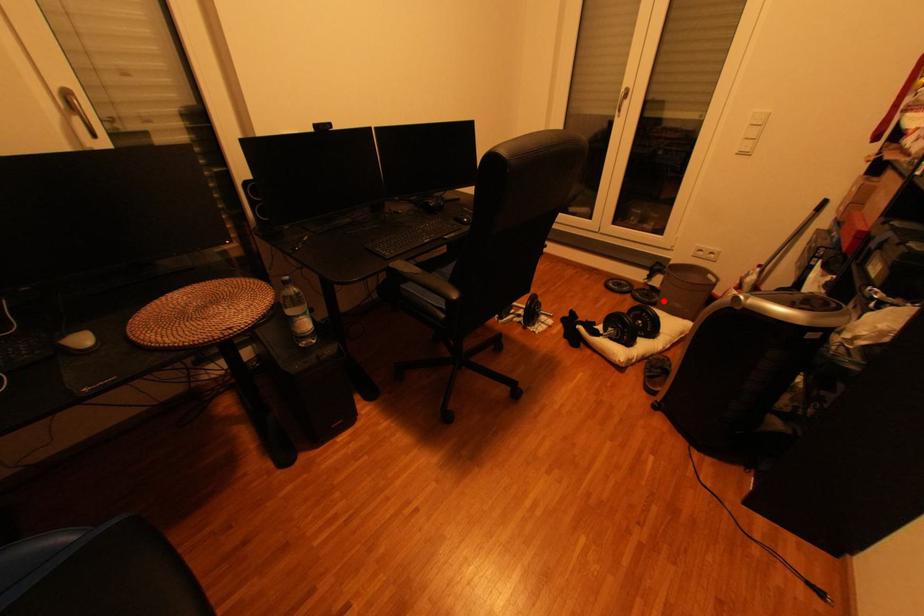
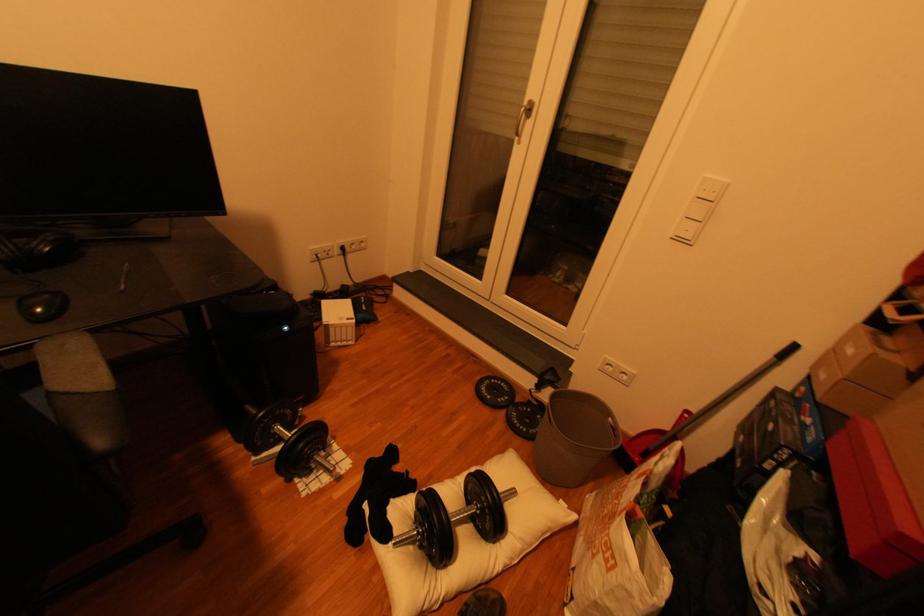
In the second image, find the point that corresponds to the highlighted location in the first image.

(543, 431)